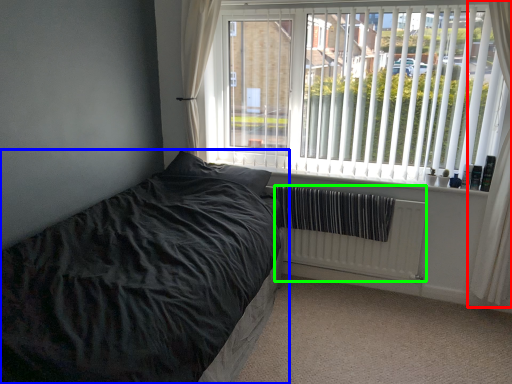
Question: Based on their relative distances, which object is nearer to curtain (highlighted by a red box)? Choose from bed (highlighted by a blue box) and radiator (highlighted by a green box).

Choices:
 (A) bed
 (B) radiator

Answer: (B)